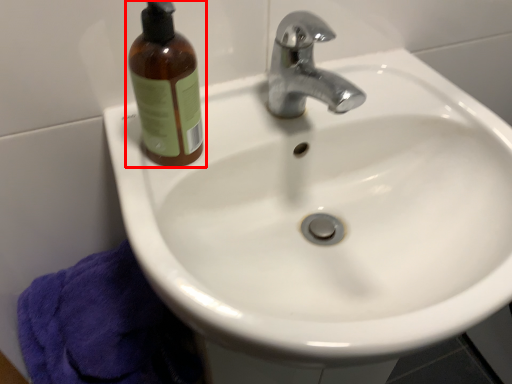
Question: Considering the relative positions of bottle (annotated by the red box) and bath towel in the image provided, where is bottle (annotated by the red box) located with respect to the staircase?

Choices:
 (A) left
 (B) right

Answer: (B)